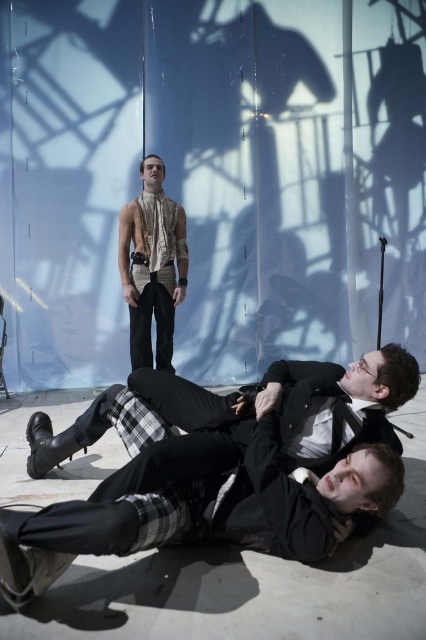
Does matte black suit at lower center have a greater width compared to plaid wool pants at lower center?

Indeed, matte black suit at lower center has a greater width compared to plaid wool pants at lower center.

Which is more to the left, matte black suit at lower center or plaid wool pants at lower center?

plaid wool pants at lower center is more to the left.

Does point (86, 547) lie behind point (328, 420)?

No.

At what (x,y) coordinates should I click in order to perform the action: click on matte black suit at lower center. Please return your answer as a coordinate pair (x, y). Image resolution: width=426 pixels, height=640 pixels. Looking at the image, I should click on (219, 467).

Is matte black suit at lower center shorter than matte beige shirt at center?

Correct, matte black suit at lower center is not as tall as matte beige shirt at center.

Does matte black suit at lower center appear on the left side of matte beige shirt at center?

No, matte black suit at lower center is not to the left of matte beige shirt at center.

Which is in front, point (331, 429) or point (158, 221)?

Point (331, 429) is more forward.

The height and width of the screenshot is (640, 426). In order to click on matte black suit at lower center in this screenshot , I will do `click(219, 467)`.

Is point (342, 378) positioned behind point (176, 262)?

No, (342, 378) is in front of (176, 262).

Can you confirm if plaid wool pants at lower center is wider than matte beige shirt at center?

Correct, the width of plaid wool pants at lower center exceeds that of matte beige shirt at center.

The height and width of the screenshot is (640, 426). I want to click on plaid wool pants at lower center, so click(x=160, y=417).